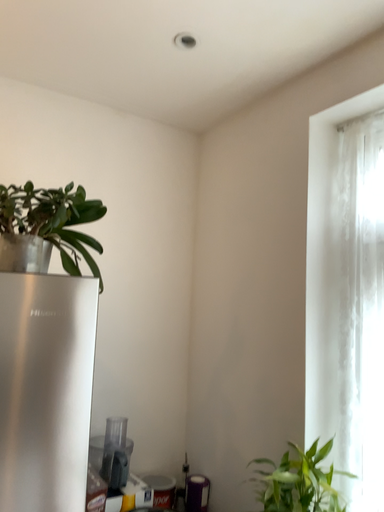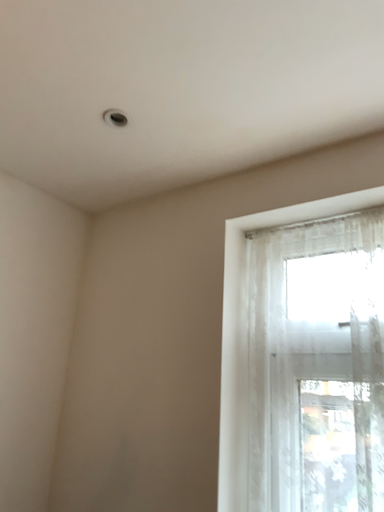
Question: How did the camera likely rotate when shooting the video?

Choices:
 (A) rotated right
 (B) rotated left

Answer: (A)